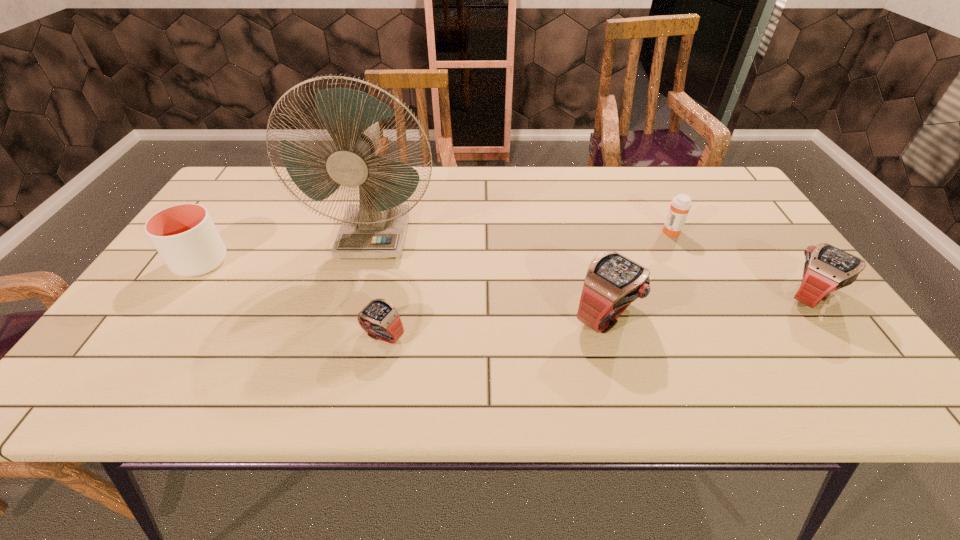
The height and width of the screenshot is (540, 960). In order to click on free space located 0.340m on the left of the rightmost watch in this screenshot , I will do `click(636, 296)`.

Find the location of a particular element. This screenshot has height=540, width=960. free region located 0.290m on the front-facing side of the fan is located at coordinates (342, 357).

The width and height of the screenshot is (960, 540). I want to click on vacant position located 0.080m on the back of the fifth object from left to right, so click(660, 208).

Locate an element on the screen. This screenshot has width=960, height=540. free spot located 0.140m on the right of the cup is located at coordinates (282, 262).

I want to click on object at the left edge, so click(184, 235).

Locate an element on the screen. The image size is (960, 540). object that is at the right edge is located at coordinates (827, 268).

In the image, there is a desktop. At what (x,y) coordinates should I click in order to perform the action: click on blank space at the far edge. Please return your answer as a coordinate pair (x, y). The height and width of the screenshot is (540, 960). Looking at the image, I should click on (555, 168).

The height and width of the screenshot is (540, 960). I want to click on vacant space at the near edge, so pyautogui.click(x=588, y=330).

This screenshot has height=540, width=960. In order to click on vacant space at the left edge of the desktop in this screenshot , I will do `click(185, 324)`.

Identify the location of vacant space at the right edge. (794, 313).